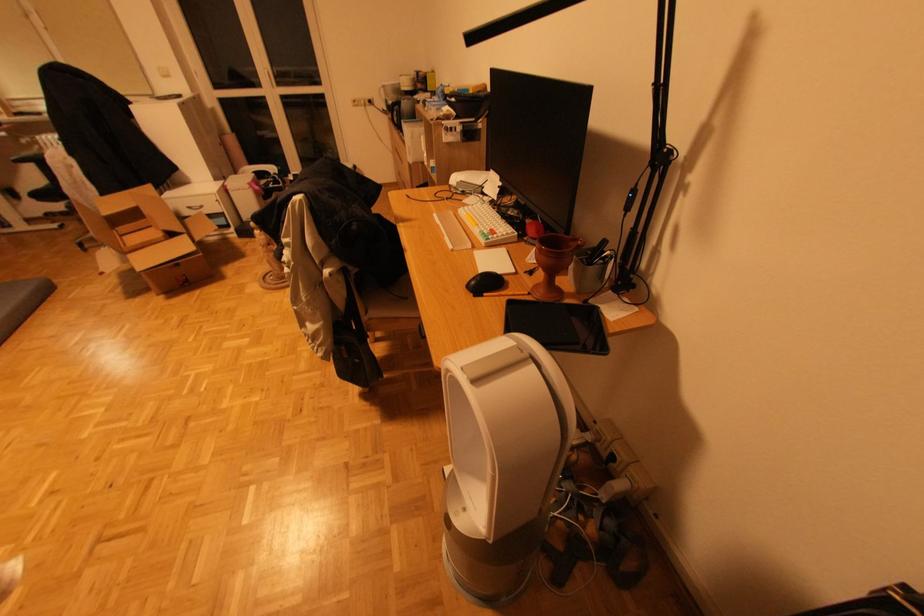
What do you see at coordinates (341, 179) in the screenshot? I see `the black bag strap` at bounding box center [341, 179].